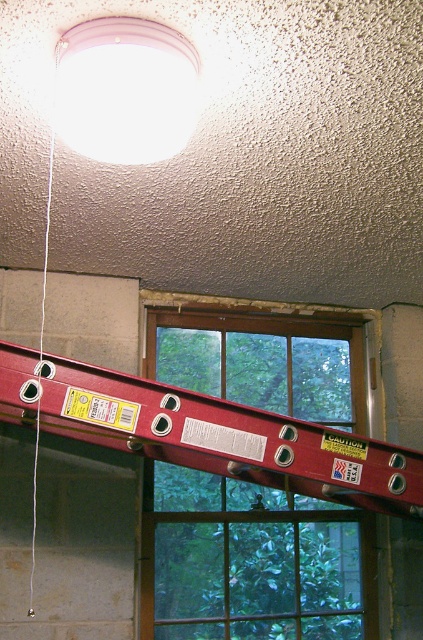
Can you confirm if clear glass window at center is bigger than white matte light fixture at upper center?

Yes, clear glass window at center is bigger than white matte light fixture at upper center.

This screenshot has width=423, height=640. Describe the element at coordinates (252, 563) in the screenshot. I see `clear glass window at center` at that location.

Where is `clear glass window at center`? This screenshot has width=423, height=640. clear glass window at center is located at coordinates (252, 563).

Does clear glass window at center come in front of white string at left?

That is False.

Find the location of a particular element. Image resolution: width=423 pixels, height=640 pixels. clear glass window at center is located at coordinates (252, 563).

Looking at this image, who is higher up, red metallic ladder at lower center or white string at left?

white string at left is higher up.

Can you confirm if red metallic ladder at lower center is positioned above white string at left?

Incorrect, red metallic ladder at lower center is not positioned above white string at left.

Where is `red metallic ladder at lower center`? The height and width of the screenshot is (640, 423). red metallic ladder at lower center is located at coordinates (206, 433).